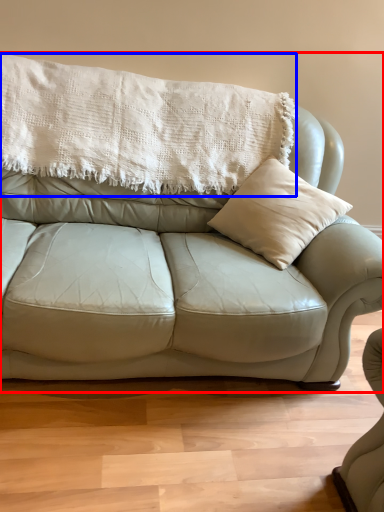
Question: Which object is closer to the camera taking this photo, studio couch (highlighted by a red box) or blanket (highlighted by a blue box)?

Choices:
 (A) studio couch
 (B) blanket

Answer: (A)